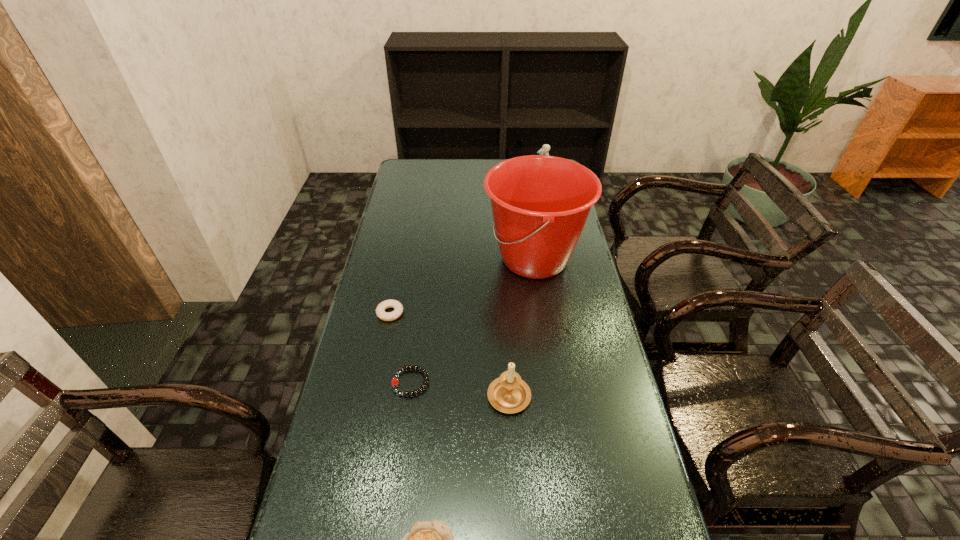
Locate an element on the screen. This screenshot has width=960, height=540. vacant space in between the doughnut and the second tallest object is located at coordinates (467, 250).

Locate an element on the screen. empty space that is in between the leftmost object and the farthest object is located at coordinates (467, 250).

What are the coordinates of `free space between the farthest object and the doughnut` in the screenshot? It's located at (467, 250).

Point out which object is positioned as the third nearest to the quiche. Please provide its 2D coordinates. Your answer should be formatted as a tuple, i.e. [(x, y)], where the tuple contains the x and y coordinates of a point satisfying the conditions above.

[(398, 308)]

Choose which object is the second nearest neighbor to the tallest object. Please provide its 2D coordinates. Your answer should be formatted as a tuple, i.e. [(x, y)], where the tuple contains the x and y coordinates of a point satisfying the conditions above.

[(398, 308)]

Locate an element on the screen. Image resolution: width=960 pixels, height=540 pixels. blank area in the image that satisfies the following two spatial constraints: 1. at the beak of the farthest object; 2. on the front side of the bracelet is located at coordinates (583, 382).